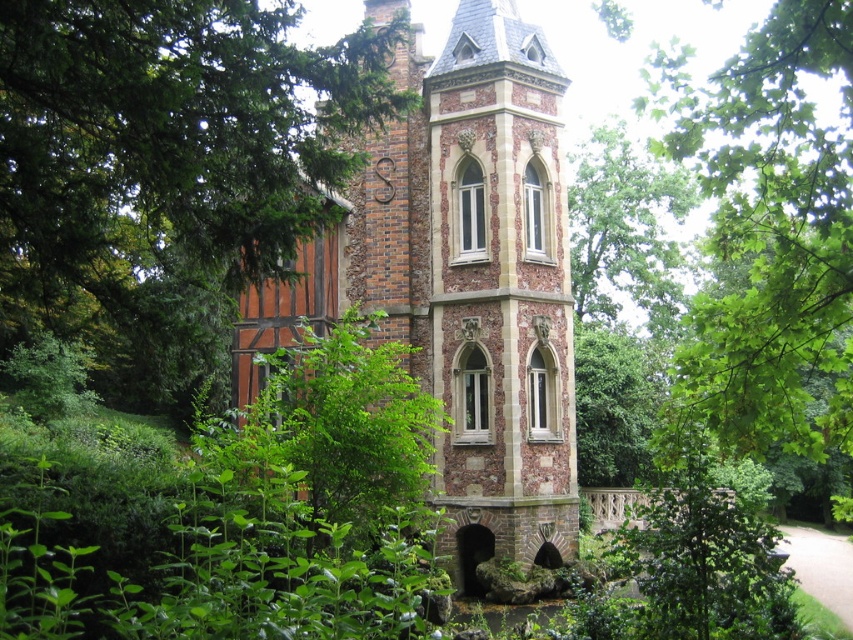
Which of these two, brick tower at center or green leafy tree at upper center, stands shorter?

Standing shorter between the two is brick tower at center.

Is point (520, 236) positioned after point (740, 84)?

Yes.

Find the location of a particular element. brick tower at center is located at coordinates (479, 280).

Where is `brick tower at center`? brick tower at center is located at coordinates (479, 280).